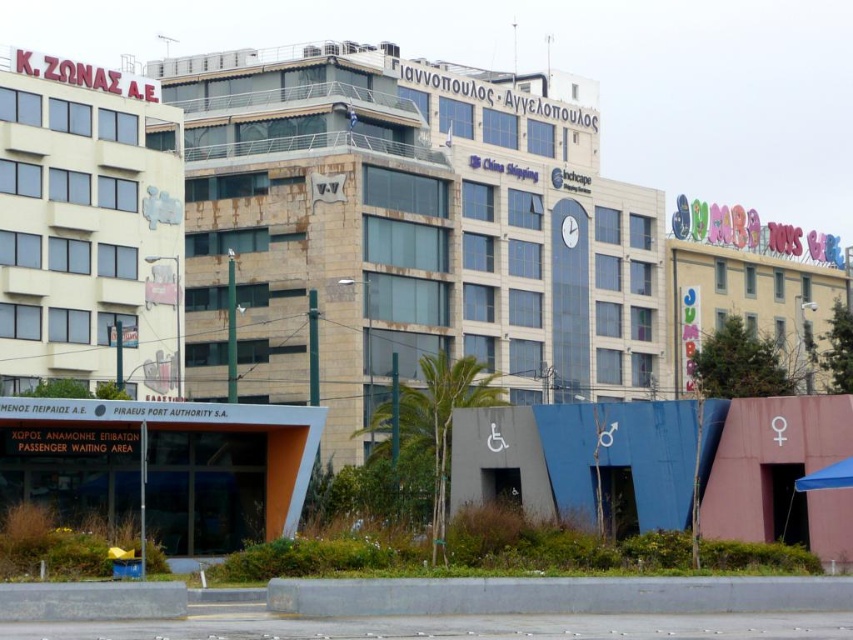
You are a city planner assessing the skyline of this area. Given the rustic stone building at center and the pastel painted building at right, which one would cast a longer shadow during midday? Please explain your reasoning based on their relative heights.

The rustic stone building at center is much taller than the pastel painted building at right. Since taller structures cast longer shadows, the rustic stone building at center would cast a longer shadow during midday.

You are a city planner evaluating the urban layout. Given the two buildings, the rustic stone building at center and the pastel painted building at right, which one has a greater width according to the scene?

The rustic stone building at center has a greater width than the pastel painted building at right.

You are a delivery driver approaching the area with the rustic stone building at center and the beige concrete building at left. Which building is closer to you as you arrive from the front?

The rustic stone building at center is closer to you because the beige concrete building at left is behind it.